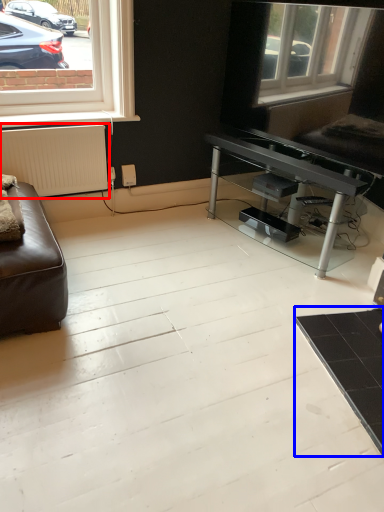
Question: Among these objects, which one is farthest to the camera, radiator (highlighted by a red box) or table (highlighted by a blue box)?

Choices:
 (A) radiator
 (B) table

Answer: (A)